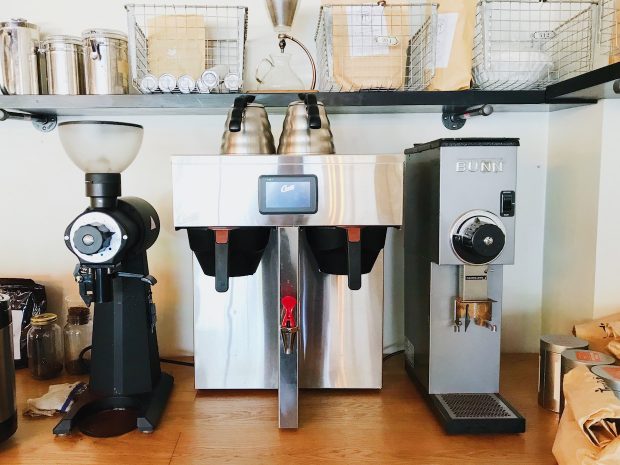
Where is `wire basket`? The image size is (620, 465). wire basket is located at coordinates (236, 28), (392, 23), (568, 39).